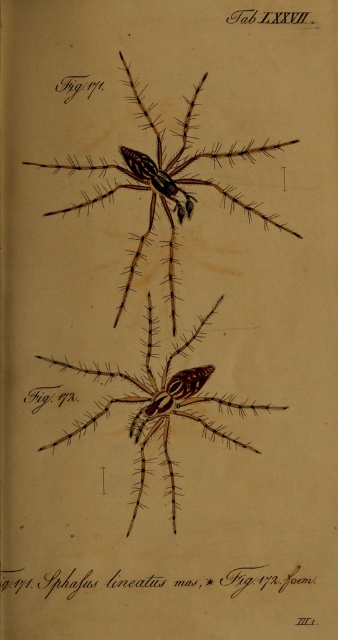
You are an entomologist examining two spiders in a scientific illustration labeled as Fig. 171 and Fig. 172. You notice both spiders are positioned at the center of the image but have different surface textures. Based on the illustration, which spider would you estimate to be physically bigger when comparing the brown textured spider at center and the brown matte spider at center?

The brown textured spider at center is larger in size compared to the brown matte spider at center according to the illustration.

You are an entomologist examining the botanical illustration. You need to locate the brown textured spider at center and the brown matte spider at center. According to the illustration, which one is positioned higher?

The brown textured spider at center is positioned higher than the brown matte spider at center.